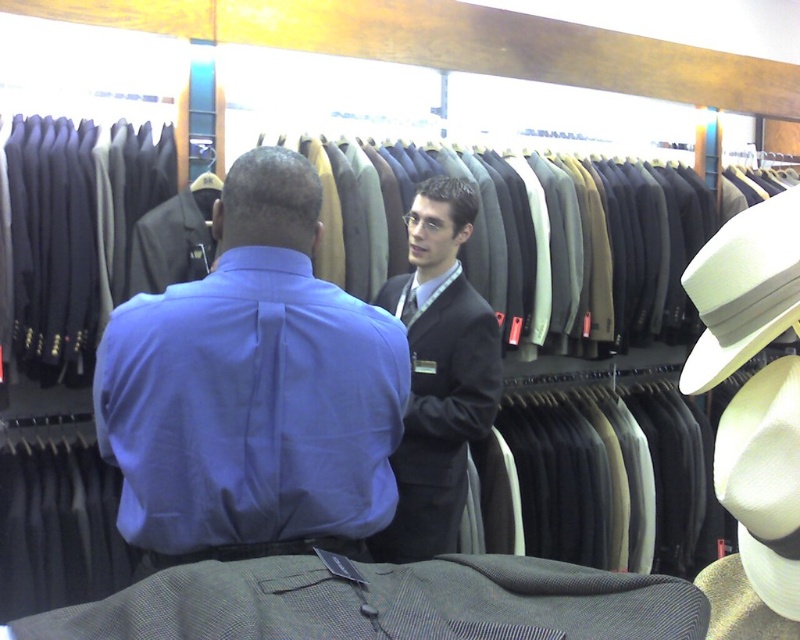
Between blue satin shirt at center and dark gray suit at center, which one appears on the right side from the viewer's perspective?

Positioned to the right is dark gray suit at center.

Can you confirm if blue satin shirt at center is shorter than dark gray suit at center?

Yes, blue satin shirt at center is shorter than dark gray suit at center.

Who is more forward, (206,509) or (413,364)?

Point (206,509)

Find the location of a particular element. This screenshot has width=800, height=640. blue satin shirt at center is located at coordinates pos(252,390).

Identify the location of dark gray suit at center. (438, 372).

From the picture: Is dark gray suit at center bigger than white felt cowboy hat at right?

Correct, dark gray suit at center is larger in size than white felt cowboy hat at right.

Who is more distant from viewer, (428,256) or (720,282)?

Positioned behind is point (428,256).

At what (x,y) coordinates should I click in order to perform the action: click on dark gray suit at center. Please return your answer as a coordinate pair (x, y). This screenshot has height=640, width=800. Looking at the image, I should click on (438, 372).

Is blue satin shirt at center to the right of white felt cowboy hat at right from the viewer's perspective?

No, blue satin shirt at center is not to the right of white felt cowboy hat at right.

Is blue satin shirt at center in front of white felt cowboy hat at right?

No.

Is point (236, 275) positioned after point (704, 278)?

Yes, point (236, 275) is behind point (704, 278).

Where is `blue satin shirt at center`? blue satin shirt at center is located at coordinates (252, 390).